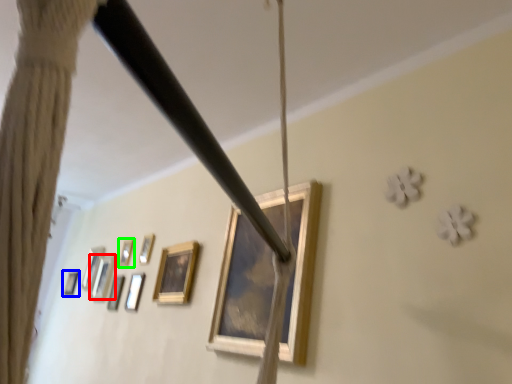
Question: Which is nearer to the picture frame (highlighted by a red box)? picture frame (highlighted by a blue box) or picture frame (highlighted by a green box).

Choices:
 (A) picture frame
 (B) picture frame

Answer: (B)